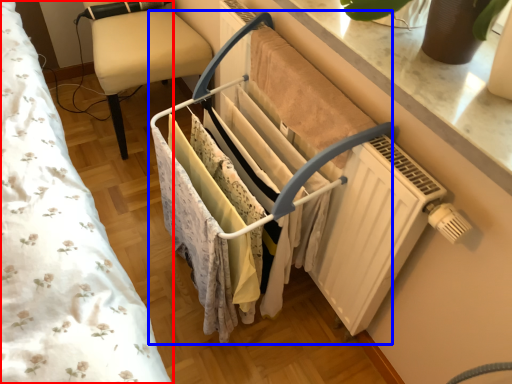
Question: Among these objects, which one is farthest to the camera, bed (highlighted by a red box) or closet (highlighted by a blue box)?

Choices:
 (A) bed
 (B) closet

Answer: (B)